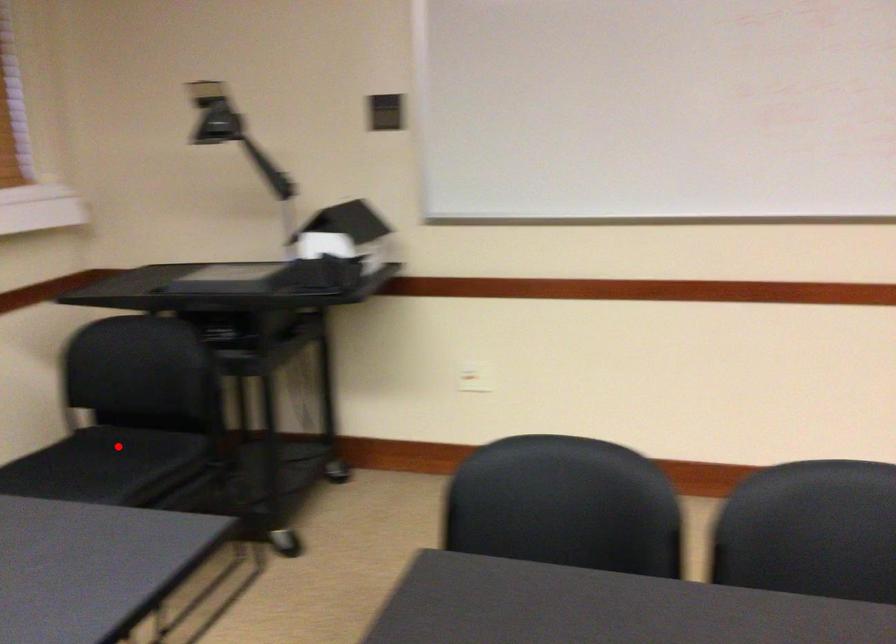
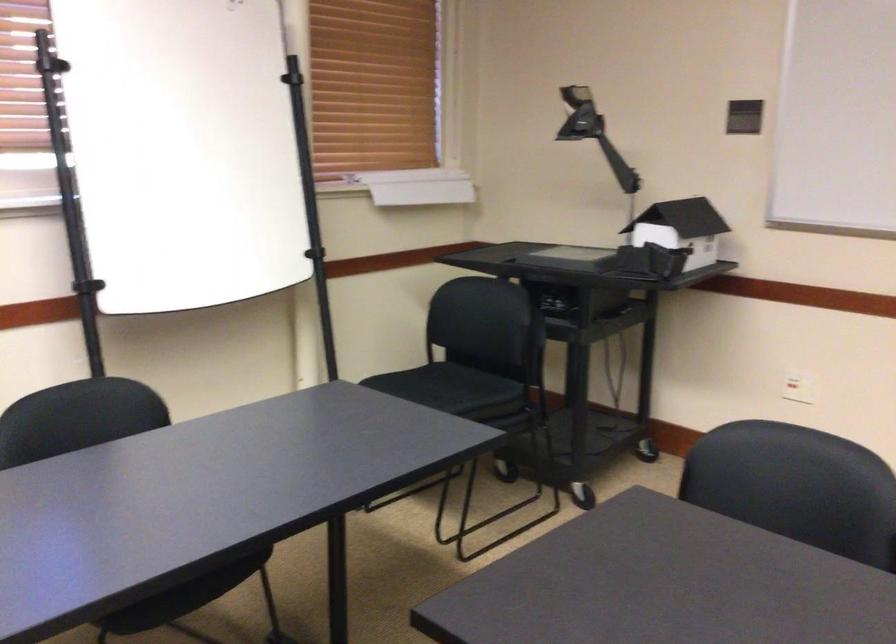
Question: I am providing you with two images of the same scene from different viewpoints. A red point is marked on the first image. Can you still see the location of the red point in image 2?

Choices:
 (A) Yes
 (B) No

Answer: (A)